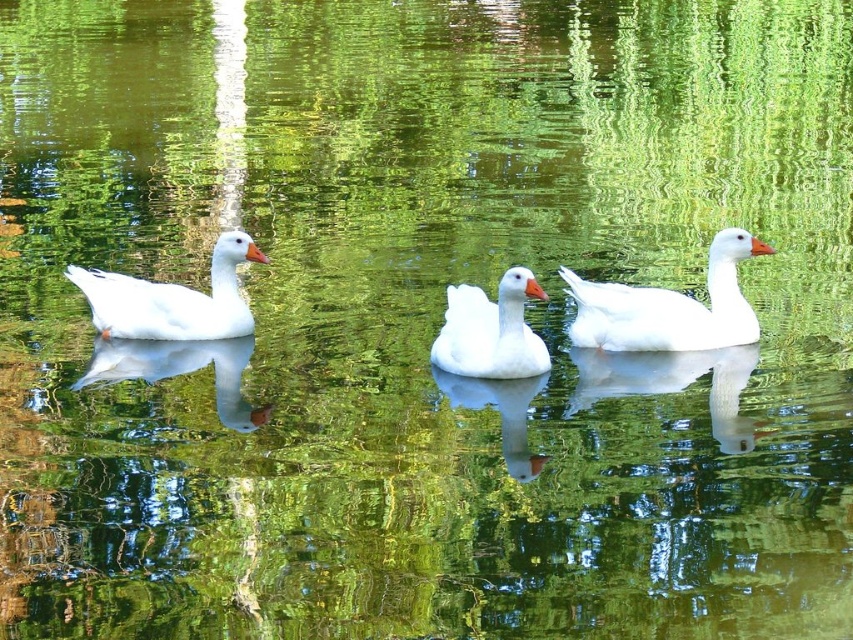
Image resolution: width=853 pixels, height=640 pixels. What do you see at coordinates (172, 298) in the screenshot?
I see `white matte duck at left` at bounding box center [172, 298].

Can you confirm if white matte duck at left is positioned below white matte duck at center?

No, white matte duck at left is not below white matte duck at center.

Is point (231, 332) closer to viewer compared to point (462, 314)?

No, it is behind (462, 314).

This screenshot has height=640, width=853. I want to click on white matte duck at left, so click(172, 298).

Locate an element on the screen. The height and width of the screenshot is (640, 853). white matte duck at right is located at coordinates (669, 307).

Is white matte duck at right thinner than white matte duck at left?

Correct, white matte duck at right's width is less than white matte duck at left's.

Find the location of a particular element. white matte duck at right is located at coordinates (669, 307).

The width and height of the screenshot is (853, 640). I want to click on white matte duck at right, so 669,307.

Is white matte duck at right smaller than white matte duck at center?

No, white matte duck at right is not smaller than white matte duck at center.

Measure the distance between point (653, 344) and camera.

Point (653, 344) is 28.14 feet away from camera.

Identify the location of white matte duck at right. This screenshot has height=640, width=853. (669, 307).